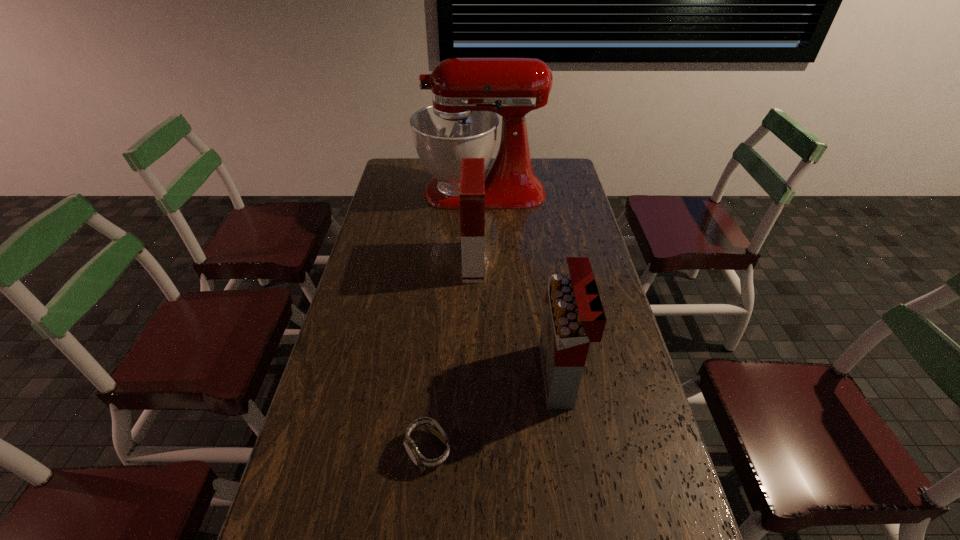
You are a GUI agent. You are given a task and a screenshot of the screen. Output one action in this format:
    pyautogui.click(x=<x>, y=<y>)
    Task: Click on the empty space between the third farthest object and the shortest object
    The image size is (960, 540).
    Given the screenshot: What is the action you would take?
    pyautogui.click(x=493, y=412)

Where is `vacant area between the second nearest object and the tallest object`? Image resolution: width=960 pixels, height=540 pixels. vacant area between the second nearest object and the tallest object is located at coordinates 520,284.

Locate an element on the screen. The image size is (960, 540). object that stands as the second closest to the third nearest object is located at coordinates (573, 316).

Image resolution: width=960 pixels, height=540 pixels. Identify the location of object that can be found as the second closest to the right cigarette case. (472, 181).

Where is `free spot that satisfies the following two spatial constraints: 1. at the attachment hub of the farthest object; 2. on the face of the watch`? Image resolution: width=960 pixels, height=540 pixels. free spot that satisfies the following two spatial constraints: 1. at the attachment hub of the farthest object; 2. on the face of the watch is located at coordinates (483, 449).

This screenshot has height=540, width=960. I want to click on free location that satisfies the following two spatial constraints: 1. with the lid open on the third farthest object; 2. on the face of the nearest object, so click(571, 449).